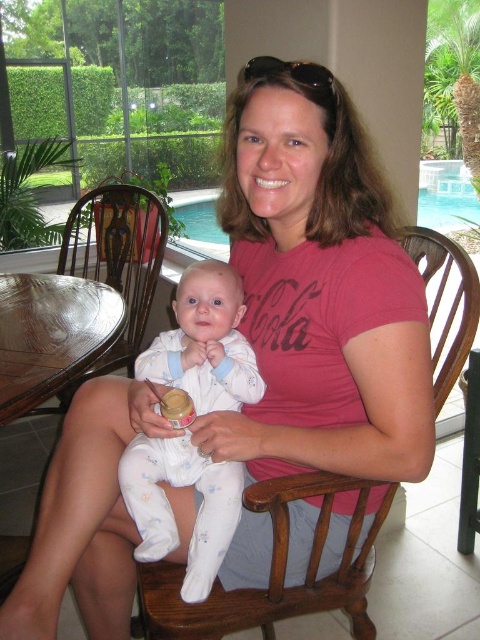
Where is the white cotton onesie at center located in the image?

The white cotton onesie at center is located at point (170, 508).

You are standing in the room and want to place a small plant between the two points marked as point (219,483) and point (432,362). Which point should the plant be closer to in order to be positioned in front of the other point?

The plant should be closer to point (219,483) because it is in front of point (432,362).

You are a photographer setting up for a family photo. You need to position the white cotton onesie at center and the wooden rocking chair at center so that the onesie is to the left of the chair. Is the current arrangement correct?

Yes, the current arrangement is correct because the white cotton onesie at center is already positioned to the left of the wooden rocking chair at center.